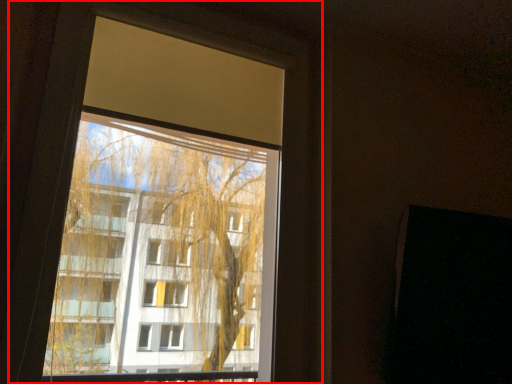
Question: From the image's perspective, where is window (annotated by the red box) located relative to screen door?

Choices:
 (A) above
 (B) below

Answer: (A)